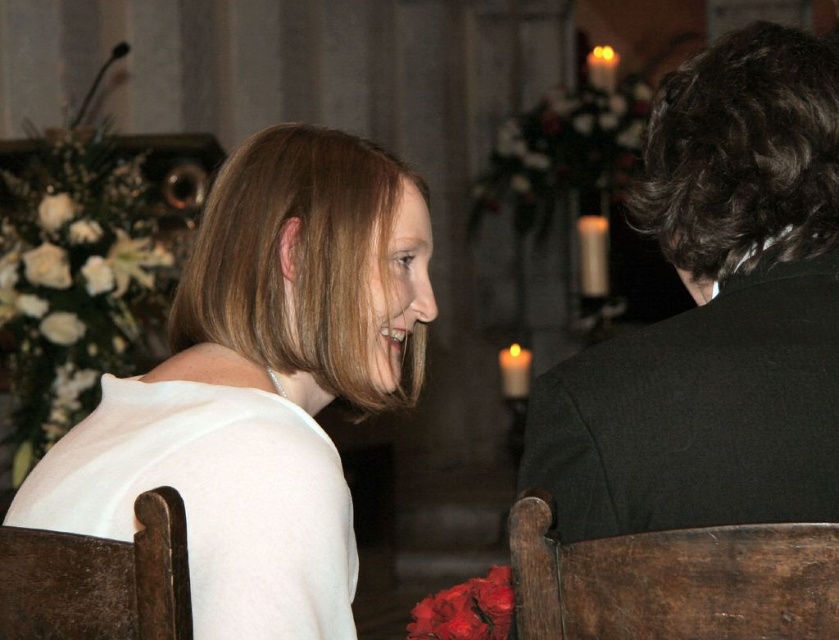
You are standing at the back of the church and want to take a photo of the two points mentioned. Which point is closer to your camera, point (756, 508) or point (652, 541)?

Point (756, 508) is closer to the camera than point (652, 541).

You are a photographer setting up for a ceremony. You need to place a 1.2 meter wide backdrop behind the white satin dress at upper left and dark brown wooden chair at right. Will the backdrop be wide enough to cover both objects?

The white satin dress at upper left is wider than the dark brown wooden chair at right. Since the backdrop is 1.2 meters wide, it depends on the combined width of both objects. However, the description only states the dress is wider than the chair, but doesn not provide exact measurements. Therefore, we cannot definitively determine if the backdrop will be sufficient without additional information.